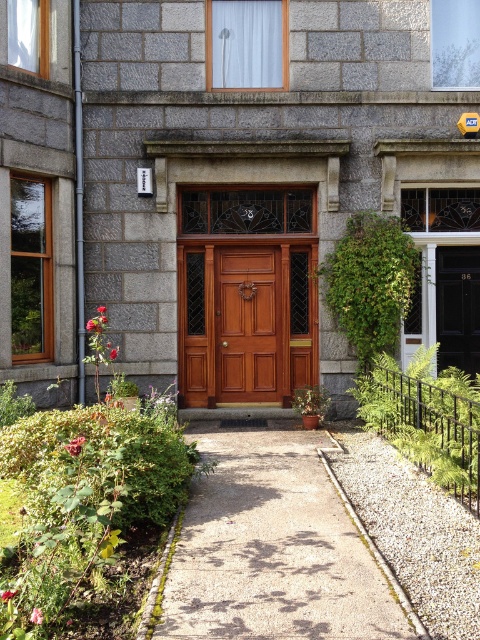
Question: Estimate the real-world distances between objects in this image. Which object is farther from the smooth concrete path at center?

Choices:
 (A) polished wood door at center
 (B) matte wood door at center

Answer: (B)

Question: Is smooth concrete path at center in front of matte wood door at center?

Choices:
 (A) no
 (B) yes

Answer: (B)

Question: Does polished wood door at center appear on the left side of matte wood door at center?

Choices:
 (A) no
 (B) yes

Answer: (B)

Question: Does smooth concrete path at center appear on the left side of polished wood door at center?

Choices:
 (A) yes
 (B) no

Answer: (B)

Question: Which object is the farthest from the polished wood door at center?

Choices:
 (A) smooth concrete path at center
 (B) matte wood door at center

Answer: (A)

Question: Which object is positioned closest to the smooth concrete path at center?

Choices:
 (A) matte wood door at center
 (B) polished wood door at center

Answer: (B)